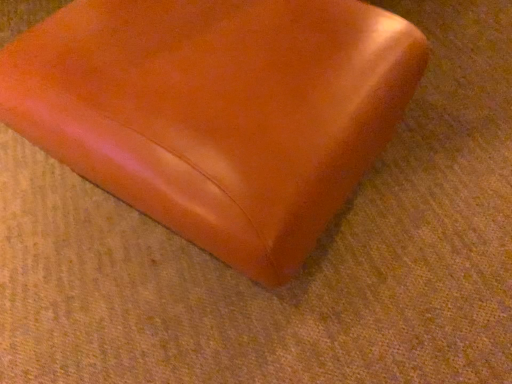
You are a GUI agent. You are given a task and a screenshot of the screen. Output one action in this format:
    pyautogui.click(x=<x>, y=<y>)
    Task: Click on the free location in front of satin orange cushion at center
    
    Given the screenshot: What is the action you would take?
    coord(256,320)